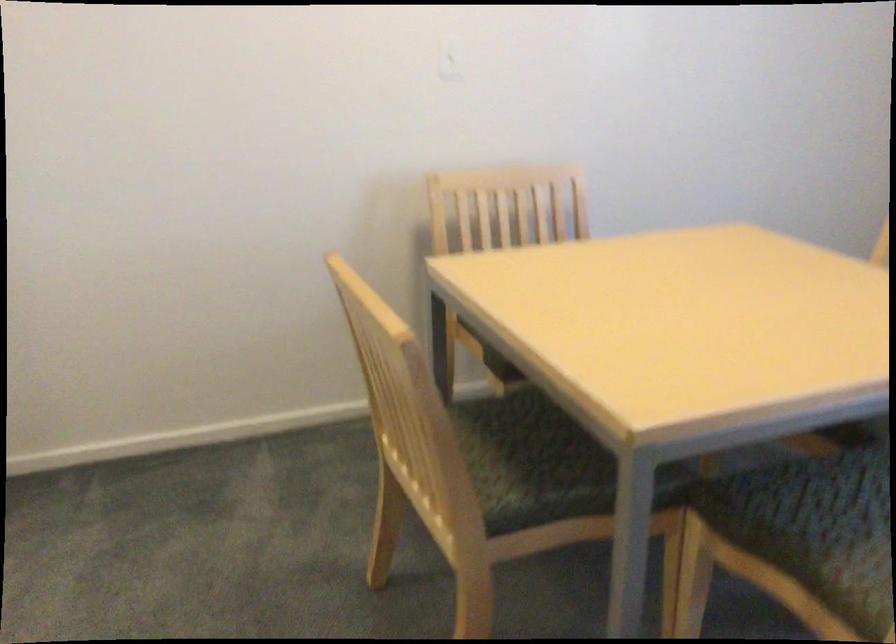
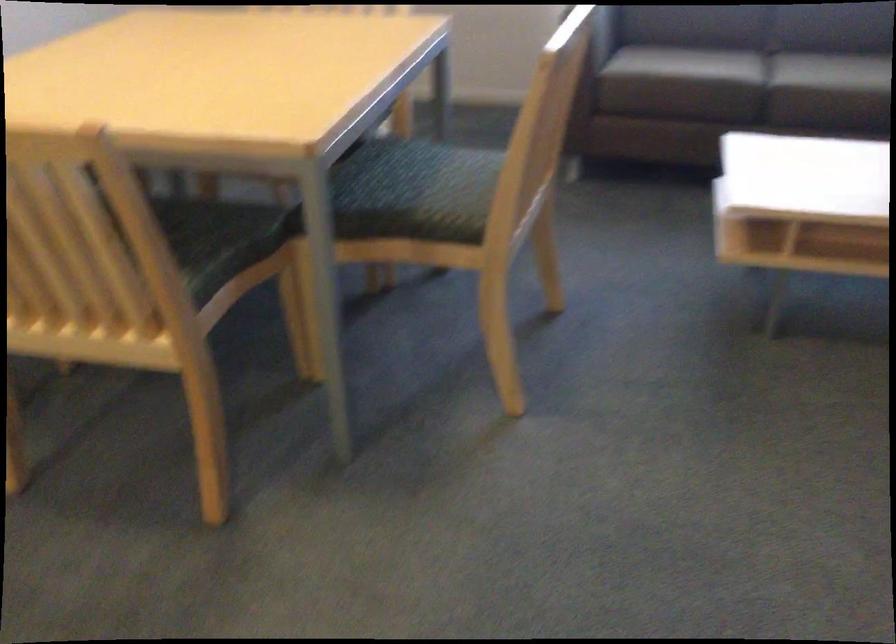
Based on the continuous images, in which direction is the camera rotating?

The camera rotated toward right-down.